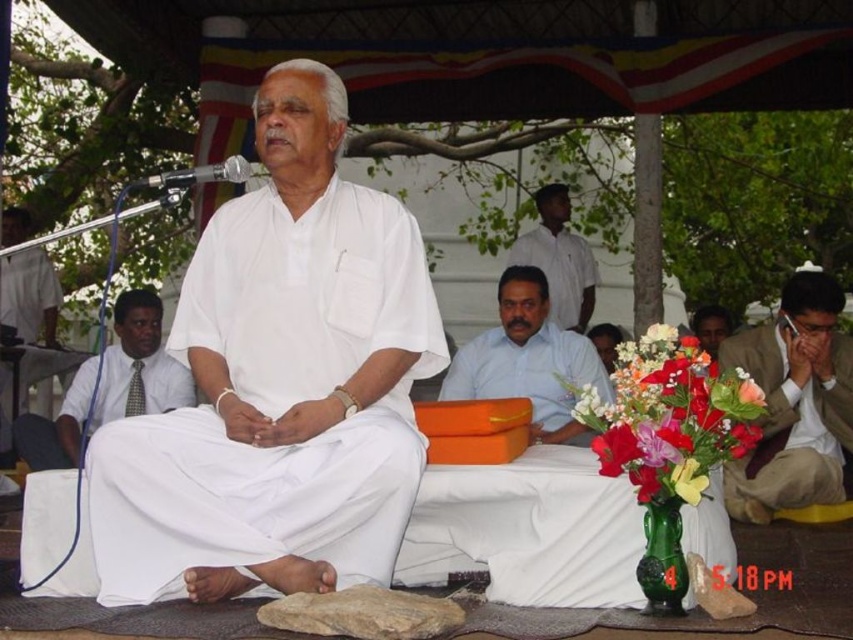
Where is `white cloth at center`? The image size is (853, 640). white cloth at center is located at coordinates (279, 384).

Who is more distant from viewer, (363, 300) or (833, 294)?

Positioned behind is point (833, 294).

Identify the location of white cloth at center. The image size is (853, 640). (279, 384).

Can you confirm if silky floral bouquet at center is positioned below matte white shirt at center?

Correct, silky floral bouquet at center is located below matte white shirt at center.

Between silky floral bouquet at center and matte white shirt at center, which one is positioned lower?

silky floral bouquet at center is lower down.

Find the location of a particular element. The height and width of the screenshot is (640, 853). silky floral bouquet at center is located at coordinates (670, 417).

Who is higher up, white fabric at left or white shirt at center?

white shirt at center is higher up.

Between white fabric at left and white shirt at center, which one appears on the right side from the viewer's perspective?

Positioned to the right is white shirt at center.

Locate an element on the screen. white fabric at left is located at coordinates pyautogui.click(x=33, y=316).

At what (x,y) coordinates should I click in order to perform the action: click on white fabric at left. Please return your answer as a coordinate pair (x, y). Looking at the image, I should click on (33, 316).